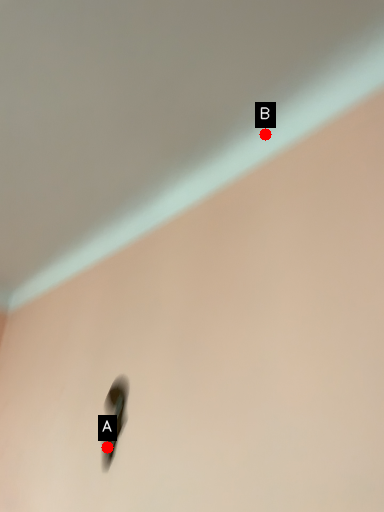
Question: Two points are circled on the image, labeled by A and B beside each circle. Which of the following is the farthest from the observer?

Choices:
 (A) A is further
 (B) B is further

Answer: (A)